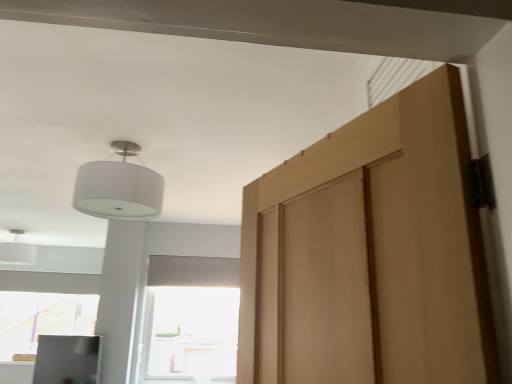
Question: From the image's perspective, is transparent glass window at center below white matte lampshade at upper left?

Choices:
 (A) no
 (B) yes

Answer: (B)

Question: Considering the relative sizes of transparent glass window at center and white matte lampshade at upper left in the image provided, is transparent glass window at center shorter than white matte lampshade at upper left?

Choices:
 (A) no
 (B) yes

Answer: (A)

Question: Is transparent glass window at center aimed at white matte lampshade at upper left?

Choices:
 (A) no
 (B) yes

Answer: (A)

Question: Would you say transparent glass window at center is outside white matte lampshade at upper left?

Choices:
 (A) no
 (B) yes

Answer: (B)

Question: Considering the relative positions of transparent glass window at center and white matte lampshade at upper left in the image provided, is transparent glass window at center to the left of white matte lampshade at upper left from the viewer's perspective?

Choices:
 (A) no
 (B) yes

Answer: (A)

Question: From a real-world perspective, is transparent glass window at center located beneath white matte lampshade at upper left?

Choices:
 (A) no
 (B) yes

Answer: (B)

Question: Does transparent glass window at center have a lesser width compared to white fabric lampshade at upper left?

Choices:
 (A) yes
 (B) no

Answer: (A)

Question: Is transparent glass window at center positioned with its back to white fabric lampshade at upper left?

Choices:
 (A) yes
 (B) no

Answer: (B)

Question: Considering the relative positions of transparent glass window at center and white fabric lampshade at upper left in the image provided, is transparent glass window at center to the right of white fabric lampshade at upper left from the viewer's perspective?

Choices:
 (A) yes
 (B) no

Answer: (A)

Question: Is transparent glass window at center completely or partially outside of white fabric lampshade at upper left?

Choices:
 (A) no
 (B) yes

Answer: (B)

Question: Does transparent glass window at center have a greater width compared to white fabric lampshade at upper left?

Choices:
 (A) no
 (B) yes

Answer: (A)

Question: Could you tell me if transparent glass window at center is turned towards white fabric lampshade at upper left?

Choices:
 (A) no
 (B) yes

Answer: (B)

Question: Can you confirm if white matte lampshade at upper left is bigger than transparent glass window at center?

Choices:
 (A) no
 (B) yes

Answer: (A)